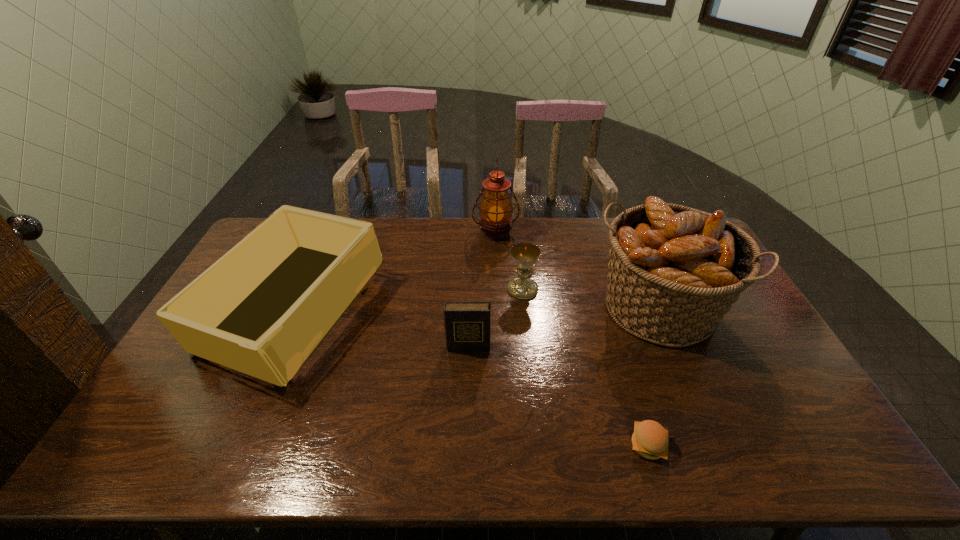
Where is `unoccupied position between the diary and the chalice`? unoccupied position between the diary and the chalice is located at coordinates (x=495, y=318).

In order to click on free space between the diary and the basket in this screenshot , I will do `click(563, 328)`.

Identify the location of free space between the chalice and the oil lamp. The width and height of the screenshot is (960, 540). (509, 261).

Where is `the fourth closest object relative to the chalice`? This screenshot has height=540, width=960. the fourth closest object relative to the chalice is located at coordinates (262, 309).

The height and width of the screenshot is (540, 960). Identify the location of object that is the second closest to the basket. (650, 439).